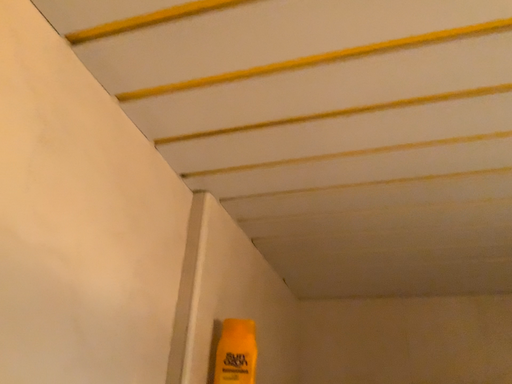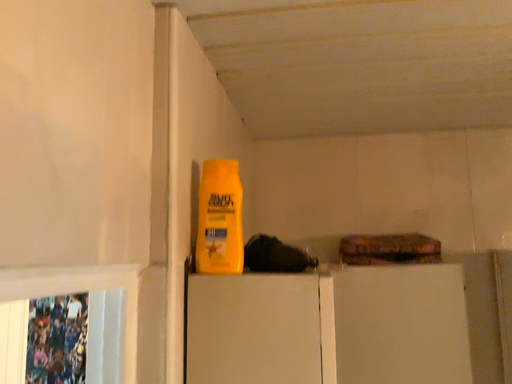
Question: How did the camera likely rotate when shooting the video?

Choices:
 (A) rotated upward
 (B) rotated downward

Answer: (B)